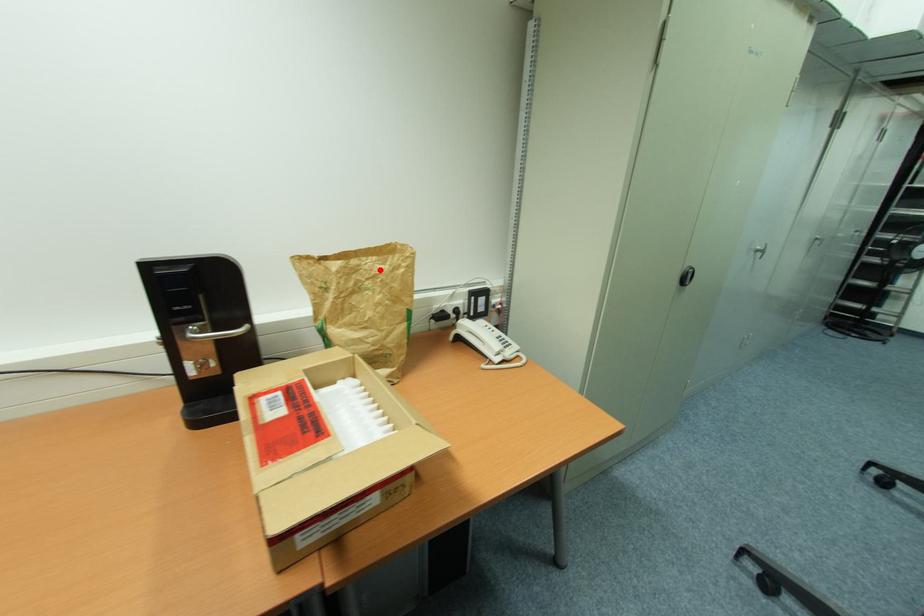
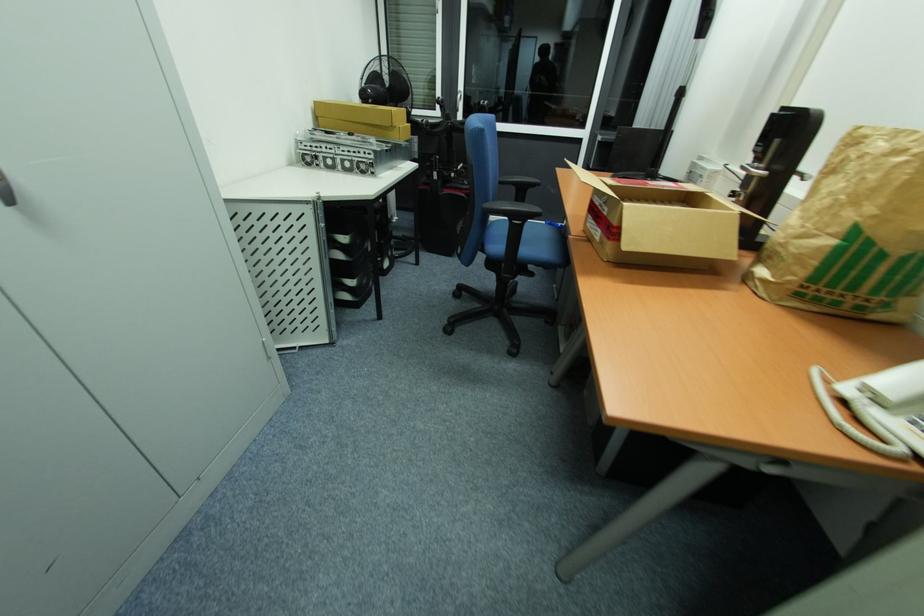
The point at the highlighted location is marked in the first image. Where is the corresponding point in the second image?

(880, 147)